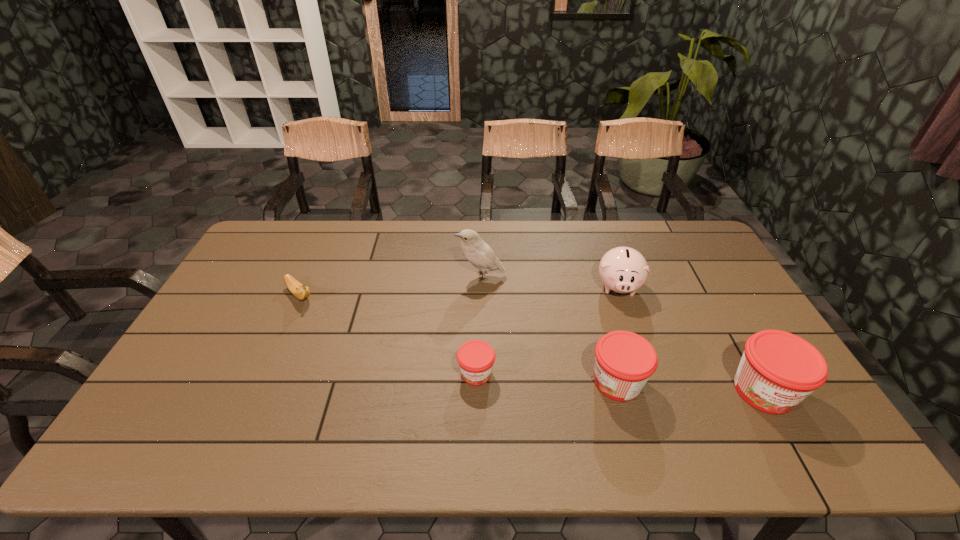
Where is `blank region between the fourth tallest object and the tallest object`? blank region between the fourth tallest object and the tallest object is located at coordinates (549, 329).

Image resolution: width=960 pixels, height=540 pixels. I want to click on empty location between the rightmost object and the second jam from right to left, so click(690, 386).

What are the coordinates of `object that is the second closest one to the piggy bank` in the screenshot? It's located at (778, 370).

Where is `object that can be found as the fifth closest to the leftmost jam`? object that can be found as the fifth closest to the leftmost jam is located at coordinates (778, 370).

Where is `jam identified as the third closest to the piggy bank`? The image size is (960, 540). jam identified as the third closest to the piggy bank is located at coordinates (475, 358).

Find the location of a particular element. This screenshot has height=540, width=960. jam that can be found as the closest to the rightmost object is located at coordinates (624, 361).

You are a GUI agent. You are given a task and a screenshot of the screen. Output one action in this format:
    pyautogui.click(x=<x>, y=<y>)
    Task: Click on the vacant space that satisfies the following two spatial constraints: 1. at the beak of the bird; 2. on the label side of the shortest jam
    
    Given the screenshot: What is the action you would take?
    pyautogui.click(x=481, y=373)

This screenshot has height=540, width=960. Identify the location of free location that satisfies the following two spatial constraints: 1. at the beak of the tallest object; 2. on the left side of the piggy bank. (481, 286).

At what (x,y) coordinates should I click in order to perform the action: click on free region that satisfies the following two spatial constraints: 1. at the beak of the piggy bank; 2. on the right side of the tallest object. Please return your answer as a coordinate pair (x, y). This screenshot has height=540, width=960. Looking at the image, I should click on 481,286.